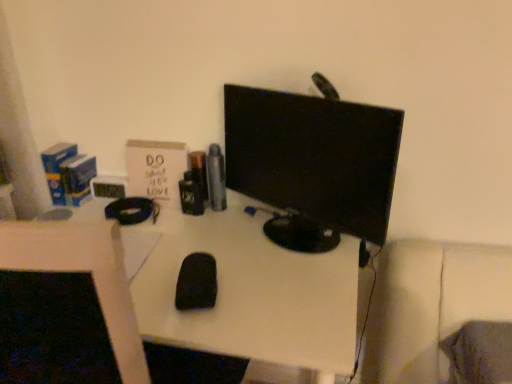
Where is `vacant space behind black matte mouse at center`? vacant space behind black matte mouse at center is located at coordinates (211, 244).